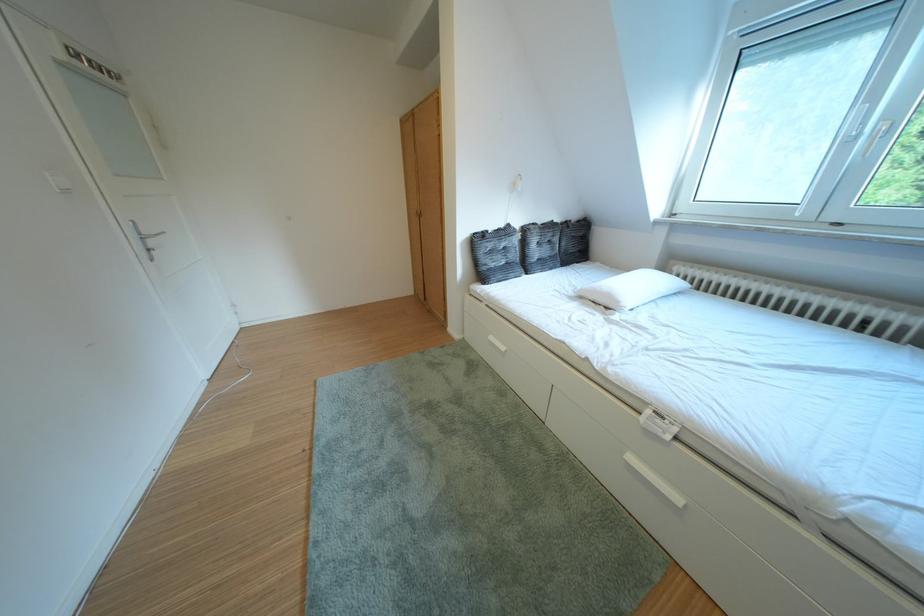
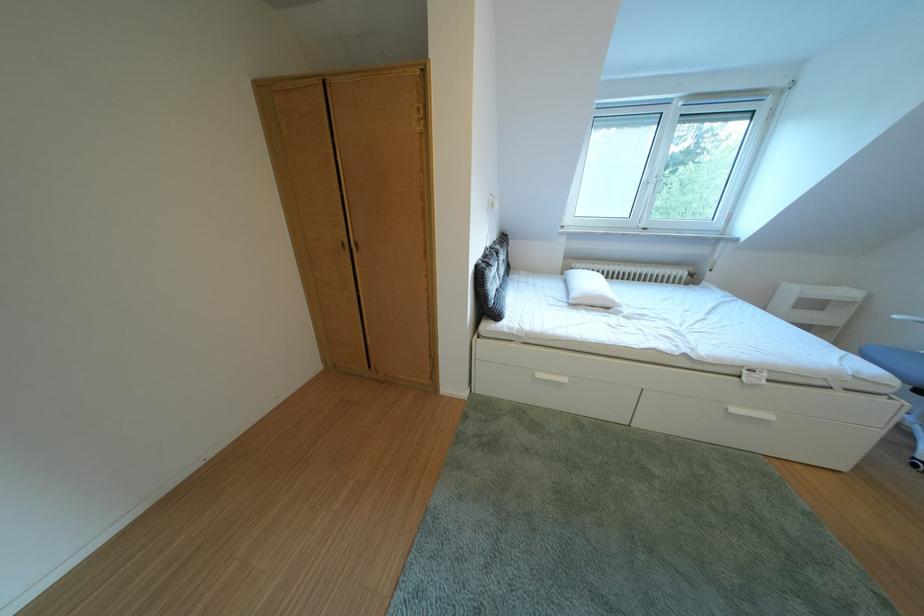
Find the pixel in the second image that matches (x=505, y=342) in the first image.

(553, 381)